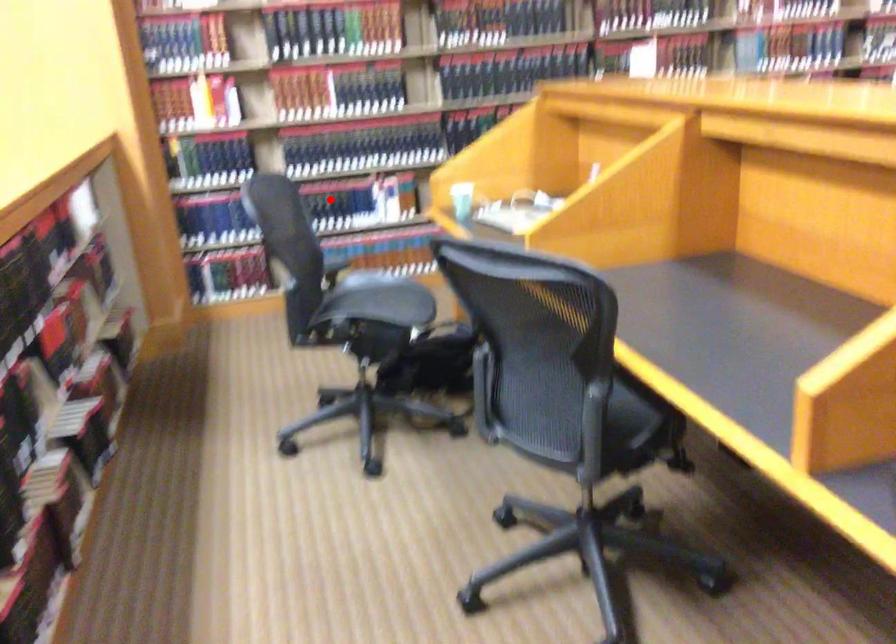
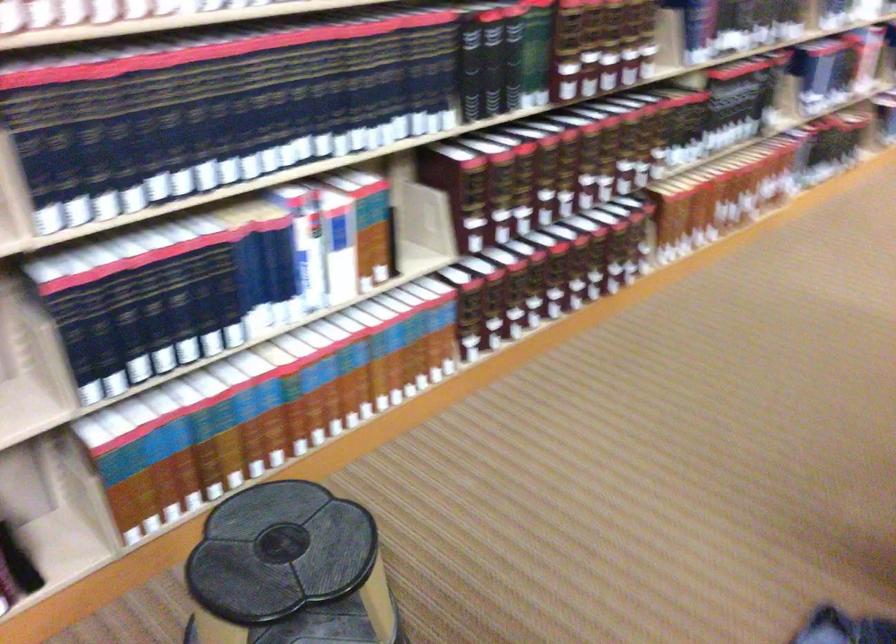
In the second image, find the point that corresponds to the highlighted location in the first image.

(200, 290)